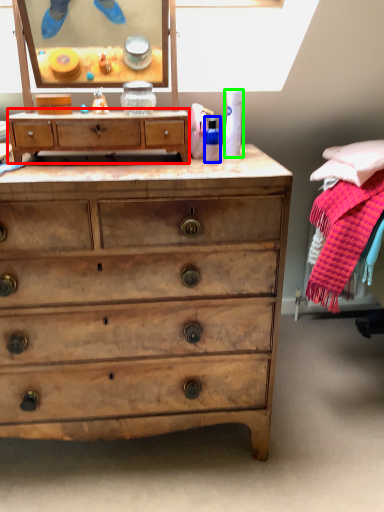
Question: Which object is the farthest from chest of drawers (highlighted by a red box)? Choose among these: toiletry (highlighted by a blue box) or toiletry (highlighted by a green box).

Choices:
 (A) toiletry
 (B) toiletry

Answer: (B)